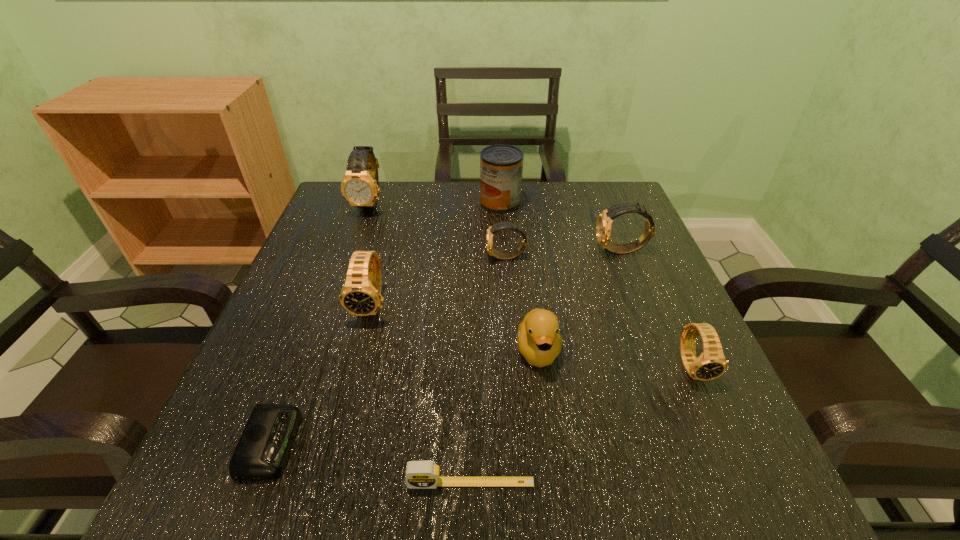
You are a GUI agent. You are given a task and a screenshot of the screen. Output one action in this format:
    pyautogui.click(x=<x>, y=<y>)
    Task: Click on the object located at the far left corner
    
    Given the screenshot: What is the action you would take?
    pyautogui.click(x=360, y=187)

Where is `object that is at the near left corner`? Image resolution: width=960 pixels, height=540 pixels. object that is at the near left corner is located at coordinates (263, 449).

Where is `vacant space at the far edge of the desktop`? vacant space at the far edge of the desktop is located at coordinates (387, 222).

In order to click on free space at the near edge in this screenshot , I will do `click(462, 458)`.

This screenshot has width=960, height=540. In the image, there is a desktop. Identify the location of free region at the left edge. (354, 324).

I want to click on free space at the right edge of the desktop, so click(717, 410).

Locate an element on the screen. The height and width of the screenshot is (540, 960). vacant space at the far left corner is located at coordinates (391, 183).

At what (x,y) coordinates should I click in order to perform the action: click on vacant area at the near left corner. Please return your answer as a coordinate pair (x, y). The image size is (960, 540). Looking at the image, I should click on (178, 514).

I want to click on free space at the far right corner of the desktop, so click(605, 199).

Where is `blank space at the near right corner of the desktop`? blank space at the near right corner of the desktop is located at coordinates (722, 465).